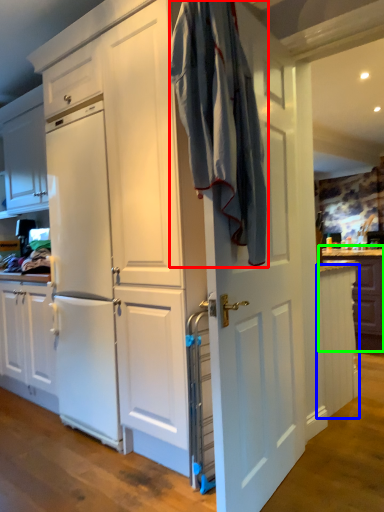
Question: Which object is the farthest from laundry (highlighted by a red box)? Choose among these: cabinetry (highlighted by a blue box) or counter (highlighted by a green box).

Choices:
 (A) cabinetry
 (B) counter

Answer: (B)